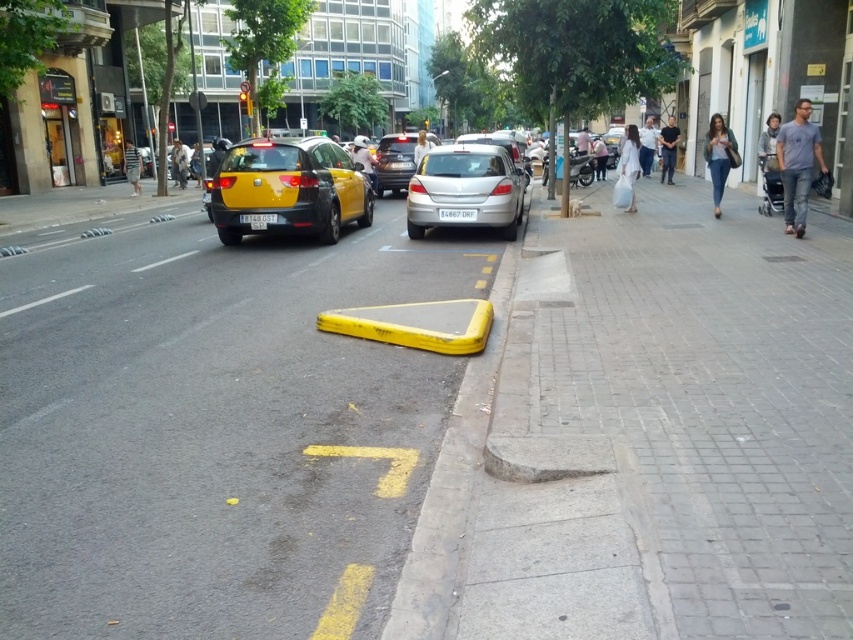
Can you confirm if silver metallic sedan at center is positioned above light brown leather jacket at upper center?

Incorrect, silver metallic sedan at center is not positioned above light brown leather jacket at upper center.

Who is positioned more to the left, silver metallic sedan at center or light brown leather jacket at upper center?

Positioned to the left is silver metallic sedan at center.

Is point (509, 180) positioned behind point (577, 141)?

No, it is in front of (577, 141).

Where is `silver metallic sedan at center`? The width and height of the screenshot is (853, 640). silver metallic sedan at center is located at coordinates (466, 189).

Is point (715, 182) positioned before point (636, 157)?

Yes, point (715, 182) is closer to viewer.

How far apart are denim jeans at right and white cotton dress at center?

A distance of 1.17 meters exists between denim jeans at right and white cotton dress at center.

The width and height of the screenshot is (853, 640). I want to click on denim jeans at right, so click(718, 156).

Where is `denim jeans at right`? denim jeans at right is located at coordinates (718, 156).

Can you confirm if yellow rubber triangle at center is smaller than silver metallic sedan at center?

Yes, yellow rubber triangle at center is smaller than silver metallic sedan at center.

Which is above, yellow rubber triangle at center or silver metallic sedan at center?

silver metallic sedan at center

This screenshot has width=853, height=640. Describe the element at coordinates (216, 429) in the screenshot. I see `yellow rubber triangle at center` at that location.

Where is `yellow rubber triangle at center`? The width and height of the screenshot is (853, 640). yellow rubber triangle at center is located at coordinates (216, 429).